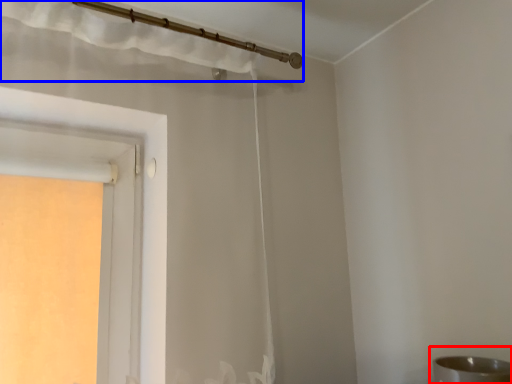
Question: Which point is closer to the camera, sink (highlighted by a red box) or curtain (highlighted by a blue box)?

Choices:
 (A) sink
 (B) curtain

Answer: (A)